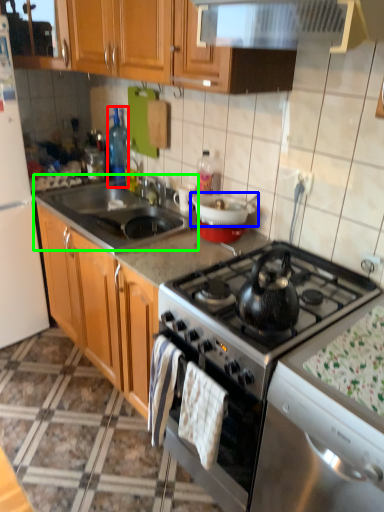
Question: Estimate the real-world distances between objects in this image. Which object is farther from bottle (highlighted by a red box), kitchen appliance (highlighted by a blue box) or sink (highlighted by a green box)?

Choices:
 (A) kitchen appliance
 (B) sink

Answer: (A)